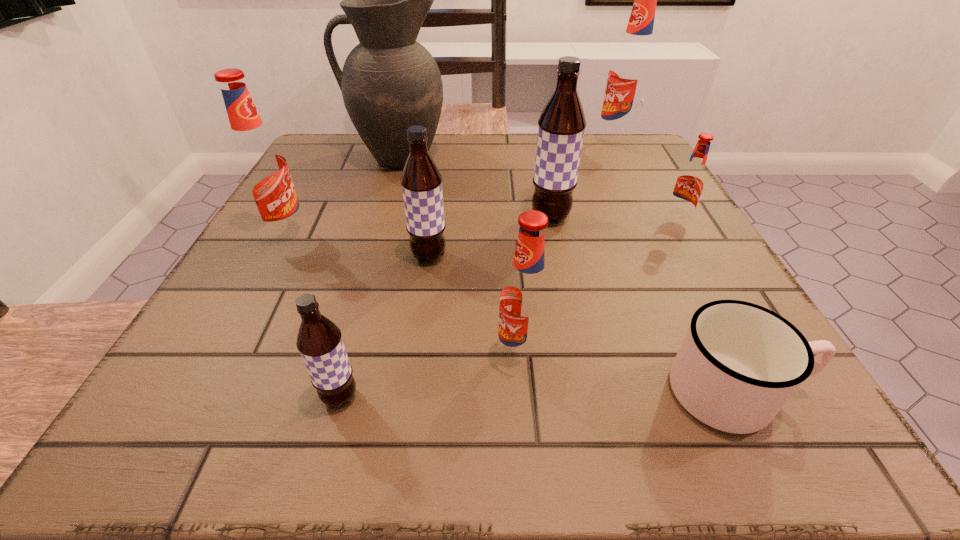
This screenshot has width=960, height=540. I want to click on the tallest root beer, so tap(631, 70).

The width and height of the screenshot is (960, 540). I want to click on the biggest red root beer, so click(x=631, y=70).

Where is `pitcher`? The width and height of the screenshot is (960, 540). pitcher is located at coordinates (389, 82).

Where is `the leftmost red root beer`? the leftmost red root beer is located at coordinates (260, 165).

Identify the location of the third smallest red root beer. (260, 165).

Identify the location of the fifth root beer from left to right. (561, 125).

Locate an element on the screen. the biggest brown root beer is located at coordinates (561, 125).

Where is `the second farthest brown root beer`? The image size is (960, 540). the second farthest brown root beer is located at coordinates (421, 180).

Where is `the third root beer from left to right`? This screenshot has width=960, height=540. the third root beer from left to right is located at coordinates (421, 180).

In order to click on the second smallest red root beer in this screenshot , I will do `click(525, 304)`.